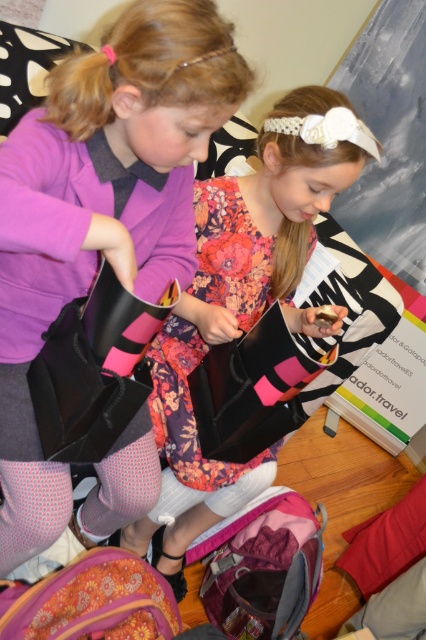
From the picture: You are standing in a room and see the matte black bag at center. If you want to grab it without moving your feet, can you reach it?

The matte black bag at center is 27.17 inches from viewer, so yes, you can reach it without moving your feet since it is within arm reach.

You are standing in the room and see two points marked in the image. Which point, point (60, 144) or point (288, 161), is closer to you?

Point (60, 144) is closer to the viewer than point (288, 161).

You are helping organize a clothing store and need to decide where to place the matte black bag at center and the floral fabric dress at center. Since the store has limited vertical space, which item should be placed on the lower shelf to ensure both items are visible?

The matte black bag at center is not as tall as the floral fabric dress at center, so the shorter matte black bag at center should be placed on the lower shelf to ensure both items are visible while accommodating the dress on a higher shelf.